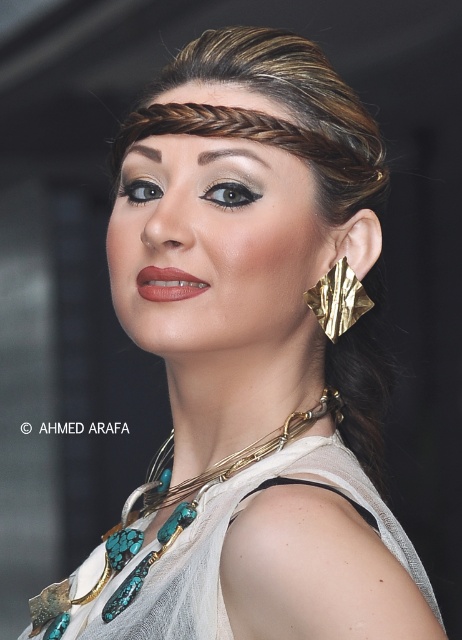
Based on the photo, you are a makeup artist trying to apply a lip gloss to the matte pink lips at center. The gold textured leaf at ear is in the way. Can you move the leaf to make space? Explain why or why not based on their distance.

The gold textured leaf at ear and matte pink lips at center are 4.20 inches apart, so you can move the gold textured leaf at ear away from the matte pink lips at center to create space for applying the lip gloss.